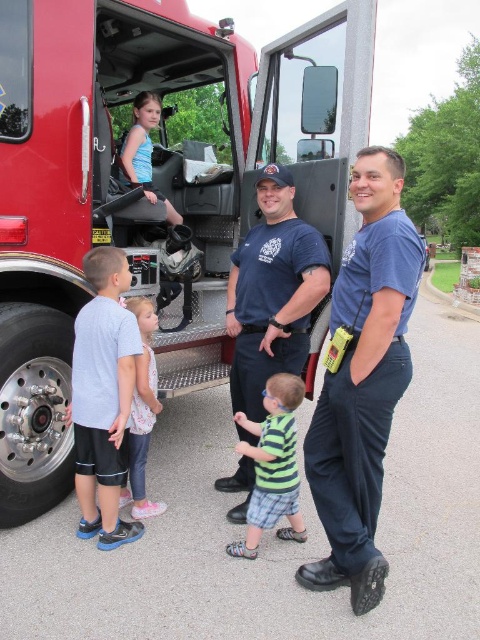
You are a photographer trying to capture a group photo of the red matte fire truck at center and the gray matte shorts at lower left. If you want to frame them both in the same shot, which object should you position closer to the camera to ensure they appear similar in size?

The gray matte shorts at lower left should be positioned closer to the camera because the red matte fire truck at center is wider, so moving the smaller gray matte shorts at lower left forward would balance their apparent sizes.

You are a photographer trying to capture a clear photo of both the green striped shirt at center and the matte black helmet at upper center. Based on their positions, which object should you focus on first to ensure both are in focus?

The green striped shirt at center is positioned under the matte black helmet at upper center, so focusing on the matte black helmet at upper center first will ensure both are in focus since it is closer to the camera.